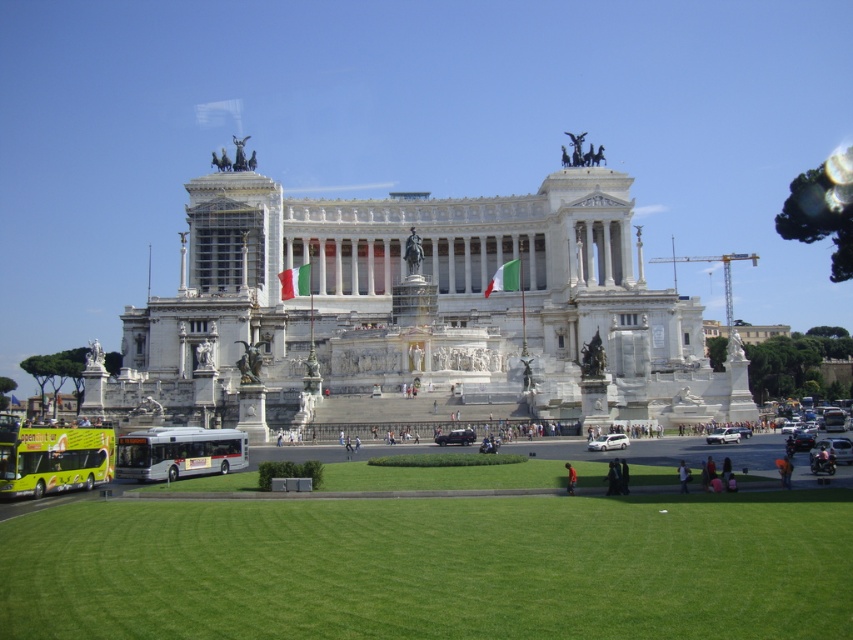
Question: Which point appears farthest from the camera in this image?

Choices:
 (A) (155, 452)
 (B) (659, 369)

Answer: (B)

Question: Which is nearer to the white marble palace at center?

Choices:
 (A) green grass at lower center
 (B) silver metallic bus at lower left

Answer: (B)

Question: In this image, where is green grass at lower center located relative to silver metallic bus at lower left?

Choices:
 (A) above
 (B) below

Answer: (B)

Question: Which object appears closest to the camera in this image?

Choices:
 (A) green grass at lower center
 (B) green matte double-decker bus at lower left
 (C) white marble palace at center

Answer: (A)

Question: Can you confirm if white marble palace at center is bigger than green grass at lower center?

Choices:
 (A) yes
 (B) no

Answer: (A)

Question: Does white marble palace at center have a lesser width compared to green matte double-decker bus at lower left?

Choices:
 (A) yes
 (B) no

Answer: (B)